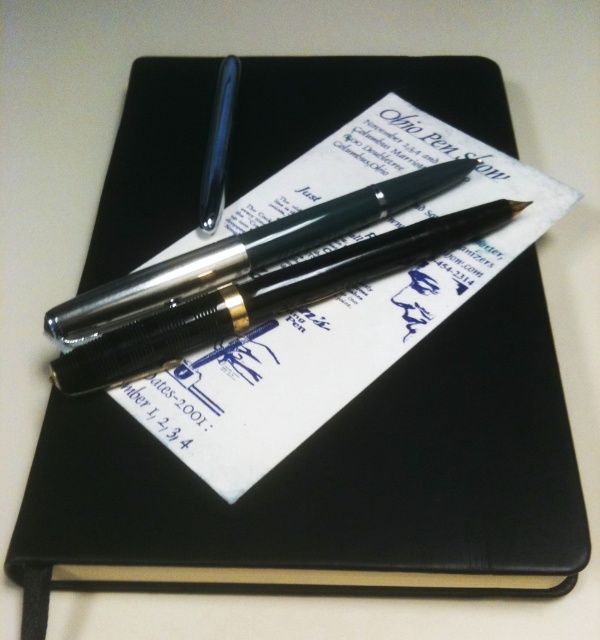
Can you confirm if metallic silver pen at center is positioned above glossy black pen at upper center?

Incorrect, metallic silver pen at center is not positioned above glossy black pen at upper center.

Between metallic silver pen at center and glossy black pen at upper center, which one appears on the right side from the viewer's perspective?

metallic silver pen at center

The height and width of the screenshot is (640, 600). What are the coordinates of `metallic silver pen at center` in the screenshot? It's located at (243, 253).